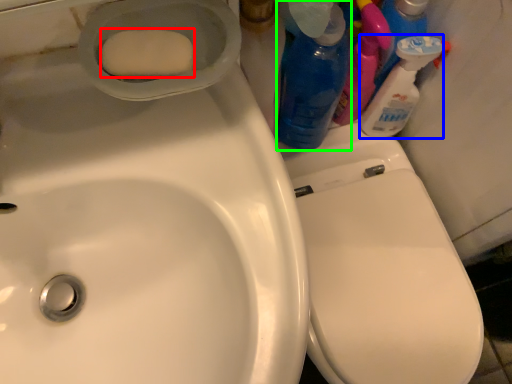
Question: Which object is the farthest from soap (highlighted by a red box)? Choose among these: cleaning product (highlighted by a blue box) or cleaning product (highlighted by a green box).

Choices:
 (A) cleaning product
 (B) cleaning product

Answer: (A)